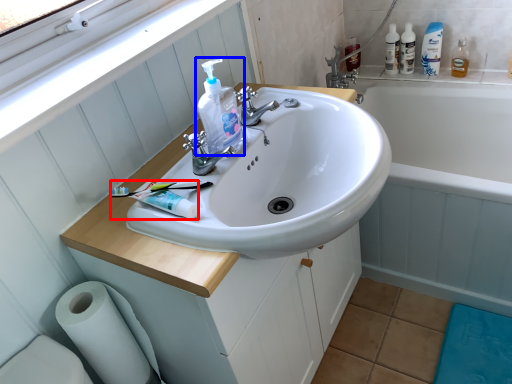
Question: Which object appears closest to the camera in this image, toothpaste (highlighted by a red box) or cleaning product (highlighted by a blue box)?

Choices:
 (A) toothpaste
 (B) cleaning product

Answer: (A)